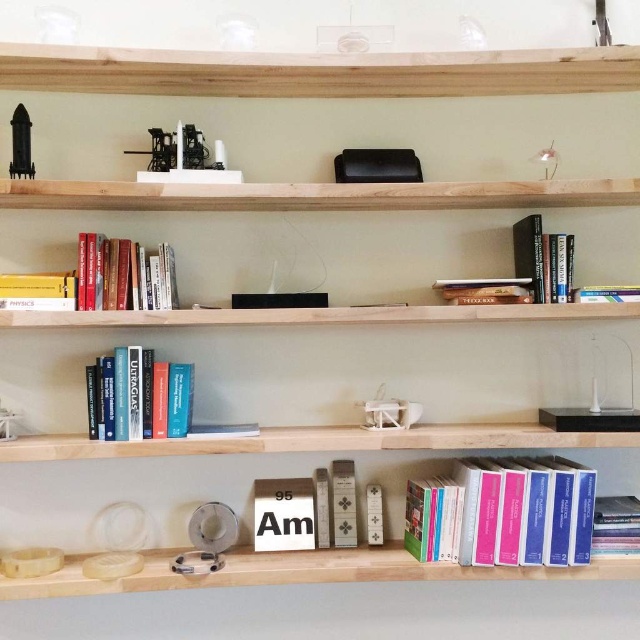
Is the position of hardcover books at upper left less distant than that of blue hardcover books at center?

Yes, it is.

Where is `hardcover books at upper left`? The height and width of the screenshot is (640, 640). hardcover books at upper left is located at coordinates (99, 280).

This screenshot has width=640, height=640. Find the location of `hardcover books at upper left`. hardcover books at upper left is located at coordinates pyautogui.click(x=99, y=280).

Is point (156, 260) more distant than point (513, 236)?

No, (156, 260) is closer to viewer.

Describe the element at coordinates (99, 280) in the screenshot. The width and height of the screenshot is (640, 640). I see `hardcover books at upper left` at that location.

Locate an element on the screen. This screenshot has height=640, width=640. hardcover books at upper left is located at coordinates (99, 280).

Describe the element at coordinates (502, 513) in the screenshot. This screenshot has width=640, height=640. I see `hardcover books at center` at that location.

Does hardcover books at center have a smaller size compared to hardcover books at upper left?

Actually, hardcover books at center might be larger than hardcover books at upper left.

Measure the distance between hardcover books at center and camera.

hardcover books at center and camera are 1.74 meters apart.

You are a GUI agent. You are given a task and a screenshot of the screen. Output one action in this format:
    pyautogui.click(x=<x>, y=<y>)
    Task: Click on the hardcover books at center
    Image resolution: width=640 pixels, height=640 pixels.
    Given the screenshot: What is the action you would take?
    pyautogui.click(x=502, y=513)